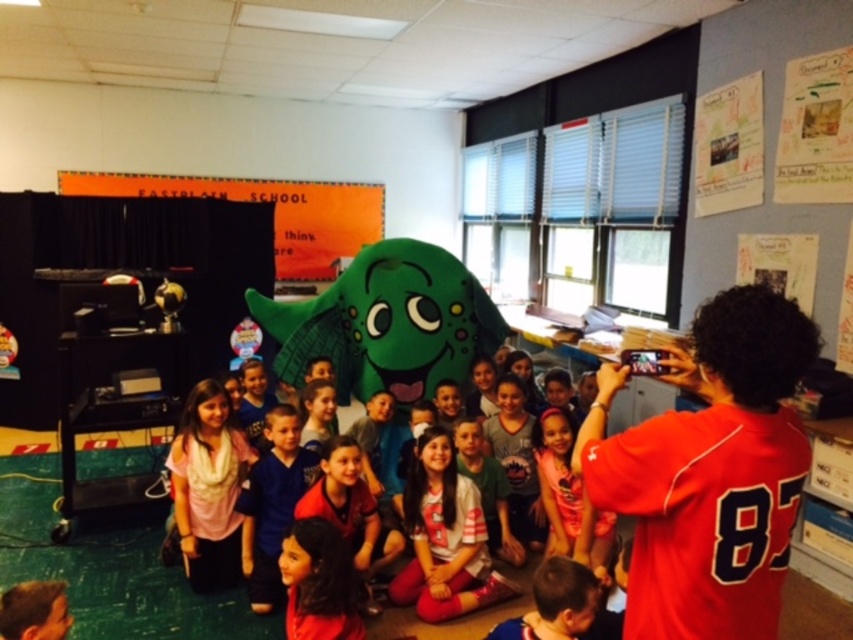
Question: Which point is farther to the camera?

Choices:
 (A) [798, 330]
 (B) [463, 275]
 (C) [349, 182]
 (D) [573, 534]

Answer: (C)

Question: Which point is farther from the camera taking this photo?

Choices:
 (A) (335, 236)
 (B) (572, 520)

Answer: (A)

Question: Which point is closer to the camera?

Choices:
 (A) orange matte/blackboard at upper center
 (B) green plush toy at center
 (C) red jersey at upper right
 (D) white cotton shirt at center

Answer: (C)

Question: From the image, what is the correct spatial relationship of red jersey at upper right in relation to orange matte/blackboard at upper center?

Choices:
 (A) left
 (B) right

Answer: (B)

Question: Is green plush toy at center to the right of pink fabric dress at center from the viewer's perspective?

Choices:
 (A) yes
 (B) no

Answer: (B)

Question: Does green plush toy at center have a greater width compared to pink fabric dress at center?

Choices:
 (A) yes
 (B) no

Answer: (A)